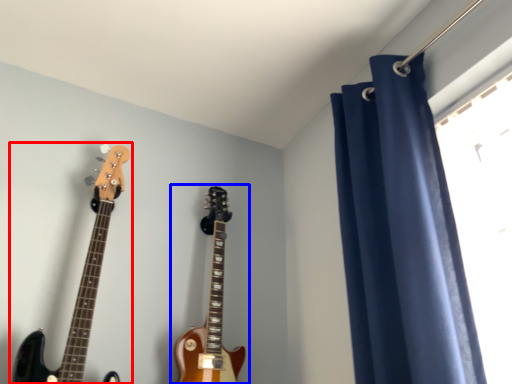
Question: Which object appears farthest to the camera in this image, guitar (highlighted by a red box) or guitar (highlighted by a blue box)?

Choices:
 (A) guitar
 (B) guitar

Answer: (B)